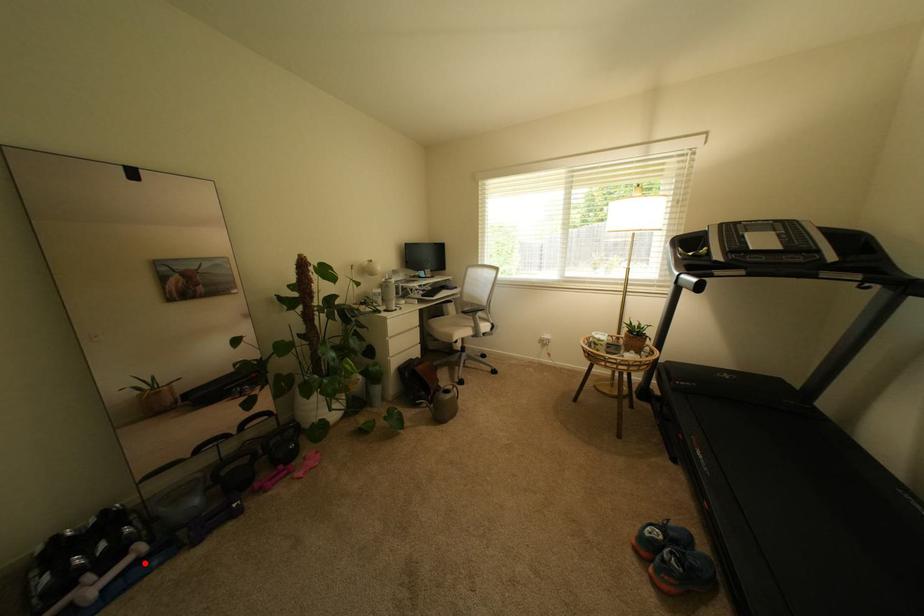
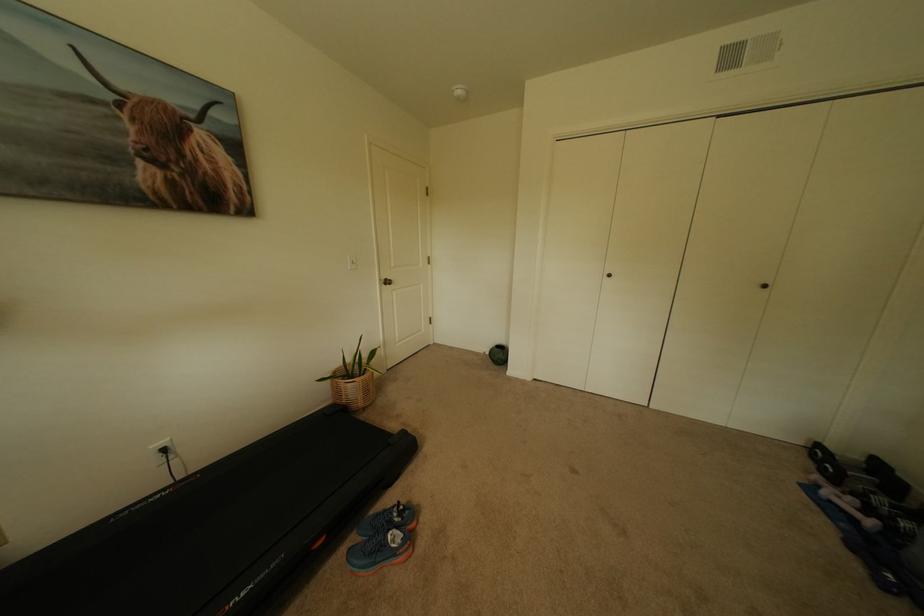
Question: I am providing you with two images of the same scene from different viewpoints. A red point is marked on the first image. Is the red point's position out of view in image 2?

Choices:
 (A) Yes
 (B) No

Answer: (B)